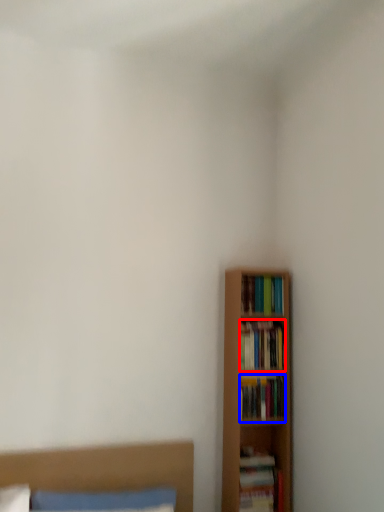
Question: Which point is closer to the camera, book (highlighted by a red box) or book (highlighted by a blue box)?

Choices:
 (A) book
 (B) book

Answer: (B)